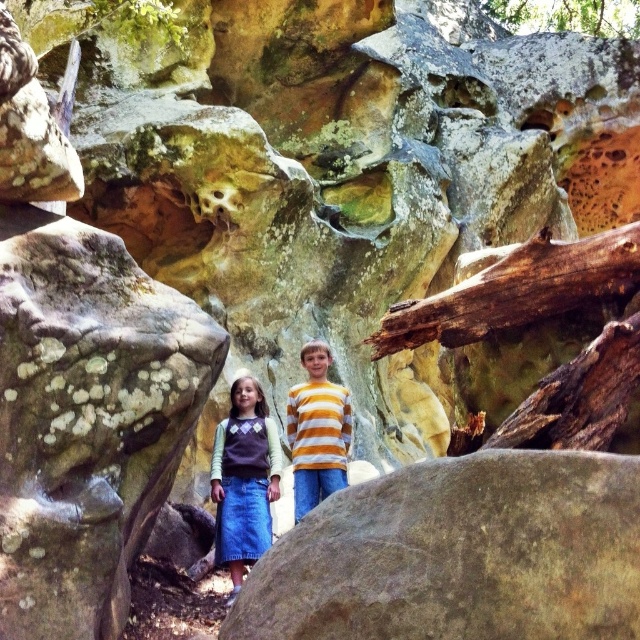
Question: Is blue denim skirt at lower left closer to camera compared to yellow striped shirt at center?

Choices:
 (A) yes
 (B) no

Answer: (A)

Question: Which object is positioned closest to the blue denim skirt at lower left?

Choices:
 (A) green leafy tree at upper right
 (B) striped cotton shirt at center

Answer: (B)

Question: Based on their relative distances, which object is farther from the yellow striped shirt at center?

Choices:
 (A) speckled stone boulder at center
 (B) green leafy tree at upper right
 (C) blue denim skirt at lower left
 (D) smooth gray rock at center

Answer: (B)

Question: Does smooth gray rock at center appear under green leafy tree at upper right?

Choices:
 (A) no
 (B) yes

Answer: (B)

Question: Among these points, which one is farthest from the camera?

Choices:
 (A) (120, 577)
 (B) (214, 554)

Answer: (B)

Question: Can you confirm if striped cotton shirt at center is positioned to the left of yellow striped shirt at center?

Choices:
 (A) yes
 (B) no

Answer: (A)